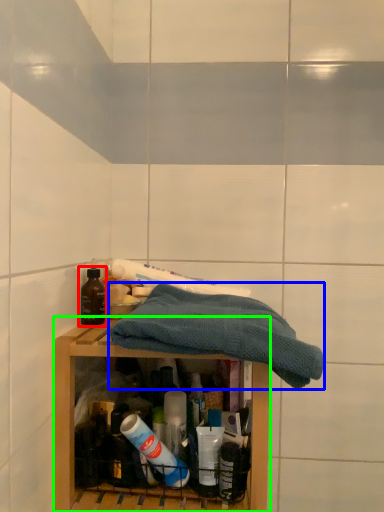
Question: Considering the real-world distances, which object is farthest from bottle (highlighted by a red box)? towel (highlighted by a blue box) or shelf (highlighted by a green box)?

Choices:
 (A) towel
 (B) shelf

Answer: (A)